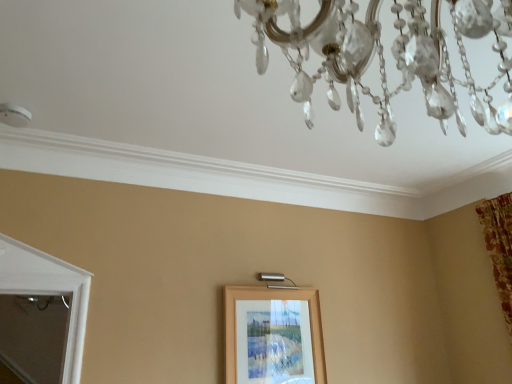
Question: From a real-world perspective, is clear crystal chandelier at upper center below wooden picture frame at center?

Choices:
 (A) no
 (B) yes

Answer: (A)

Question: Is clear crystal chandelier at upper center positioned far away from wooden picture frame at center?

Choices:
 (A) no
 (B) yes

Answer: (B)

Question: Does clear crystal chandelier at upper center have a lesser height compared to wooden picture frame at center?

Choices:
 (A) yes
 (B) no

Answer: (A)

Question: Can you confirm if clear crystal chandelier at upper center is bigger than wooden picture frame at center?

Choices:
 (A) no
 (B) yes

Answer: (B)

Question: Does clear crystal chandelier at upper center appear on the right side of wooden picture frame at center?

Choices:
 (A) yes
 (B) no

Answer: (A)

Question: From the image's perspective, is clear crystal chandelier at upper center located beneath wooden picture frame at center?

Choices:
 (A) no
 (B) yes

Answer: (A)

Question: Is wooden picture frame at center oriented towards clear crystal chandelier at upper center?

Choices:
 (A) yes
 (B) no

Answer: (A)

Question: Can you confirm if wooden picture frame at center is taller than clear crystal chandelier at upper center?

Choices:
 (A) yes
 (B) no

Answer: (A)

Question: Is wooden picture frame at center oriented away from clear crystal chandelier at upper center?

Choices:
 (A) no
 (B) yes

Answer: (A)

Question: Is wooden picture frame at center shorter than clear crystal chandelier at upper center?

Choices:
 (A) yes
 (B) no

Answer: (B)

Question: Is wooden picture frame at center thinner than clear crystal chandelier at upper center?

Choices:
 (A) yes
 (B) no

Answer: (A)

Question: Is wooden picture frame at center positioned in front of clear crystal chandelier at upper center?

Choices:
 (A) yes
 (B) no

Answer: (B)

Question: Do you think wooden picture frame at center is within clear crystal chandelier at upper center, or outside of it?

Choices:
 (A) outside
 (B) inside

Answer: (A)